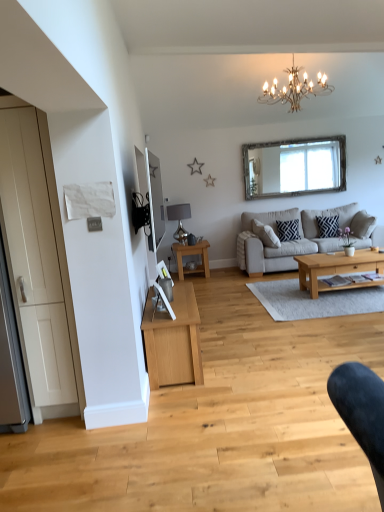
Image resolution: width=384 pixels, height=512 pixels. I want to click on free spot in front of white matte door at left, so click(x=51, y=456).